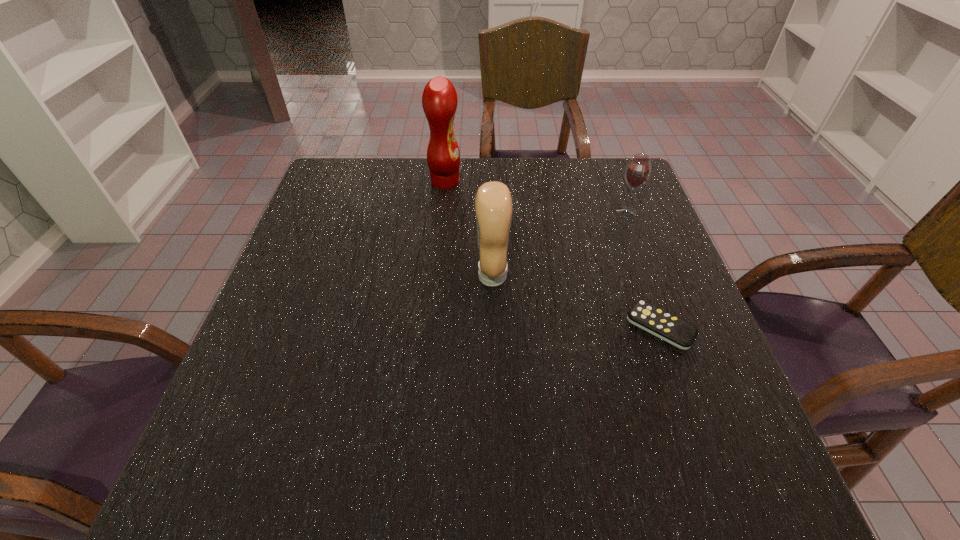
Where is `vacant area situated 0.130m on the label of the third shortest object`? vacant area situated 0.130m on the label of the third shortest object is located at coordinates (419, 275).

Where is `vacant area situated 0.110m on the label of the third shortest object`? This screenshot has width=960, height=540. vacant area situated 0.110m on the label of the third shortest object is located at coordinates (427, 275).

Find the location of a particular element. free location located 0.120m on the left of the wineglass is located at coordinates (568, 212).

Locate an element on the screen. This screenshot has height=540, width=960. vacant point located on the left of the nearest object is located at coordinates (476, 327).

In order to click on condiment present at the far edge in this screenshot , I will do `click(439, 100)`.

Where is `wineglass that is positioned at the far edge`? wineglass that is positioned at the far edge is located at coordinates (638, 170).

Where is `wineglass present at the right edge`? The height and width of the screenshot is (540, 960). wineglass present at the right edge is located at coordinates (638, 170).

Locate an element on the screen. This screenshot has width=960, height=540. remote control located at the right edge is located at coordinates (656, 321).

You are a GUI agent. You are given a task and a screenshot of the screen. Output one action in this format:
    pyautogui.click(x=<x>, y=<y>)
    Task: Click on the object located at the far right corner
    The height and width of the screenshot is (540, 960).
    Given the screenshot: What is the action you would take?
    pyautogui.click(x=638, y=170)

Where is `vacant area at the far edge of the desktop`? Image resolution: width=960 pixels, height=540 pixels. vacant area at the far edge of the desktop is located at coordinates (451, 202).